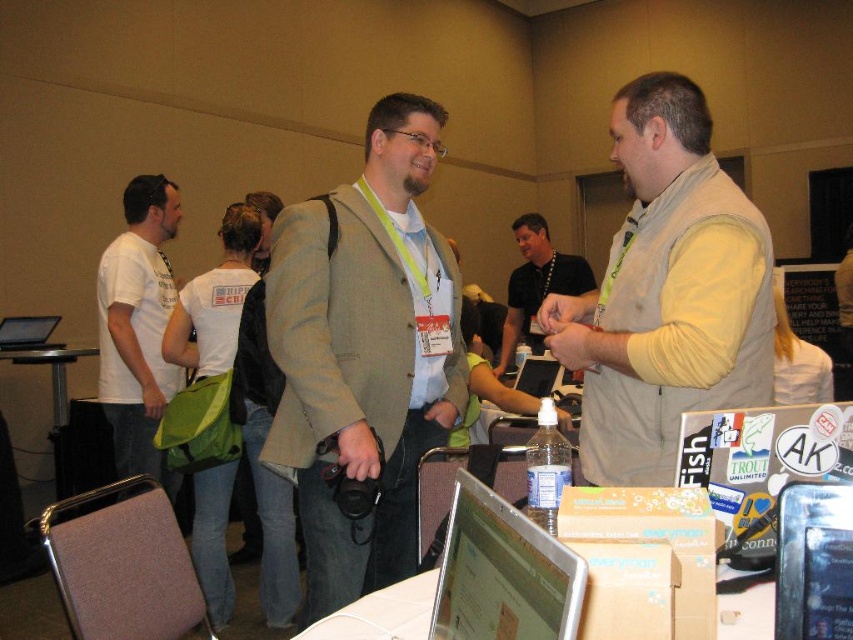
You are organizing a conference and need to place a promotional banner between the metallic silver table at lower left and the matte black laptop at center. Based on their positions, which object should the banner be placed closer to?

The metallic silver table at lower left is to the left of the matte black laptop at center, so the banner should be placed closer to the metallic silver table at lower left to be between them.

You are standing at the entrance of the event and want to place a 15 cm tall object on the metallic silver table at lower left or the matte black laptop at center. Which surface can accommodate the object without it being too tall?

The metallic silver table at lower left is taller than the matte black laptop at center, so the object can be placed on the metallic silver table at lower left since it can accommodate taller items.

What is located at the coordinates point (364, 355)?

The light brown textured blazer at center is located at point (364, 355).